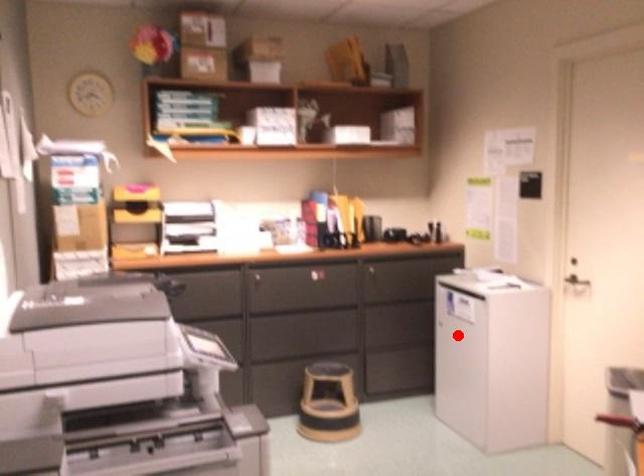
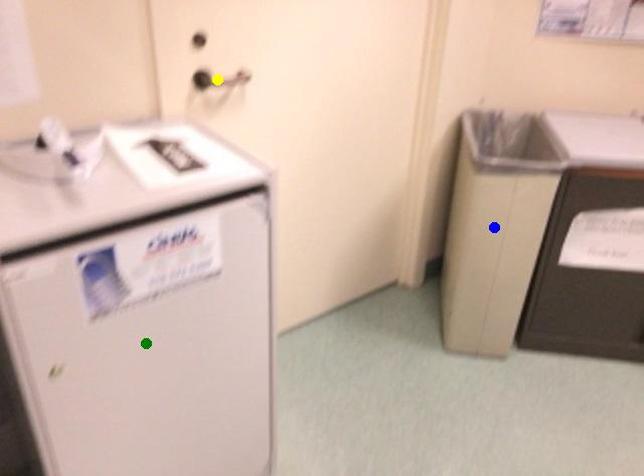
Question: I am providing you with two images of the same scene from different viewpoints. A red point is marked on the first image. You are given multiple points on the second image. Which spot in image 2 lines up with the point in image 1?

Choices:
 (A) green point
 (B) yellow point
 (C) blue point

Answer: (A)